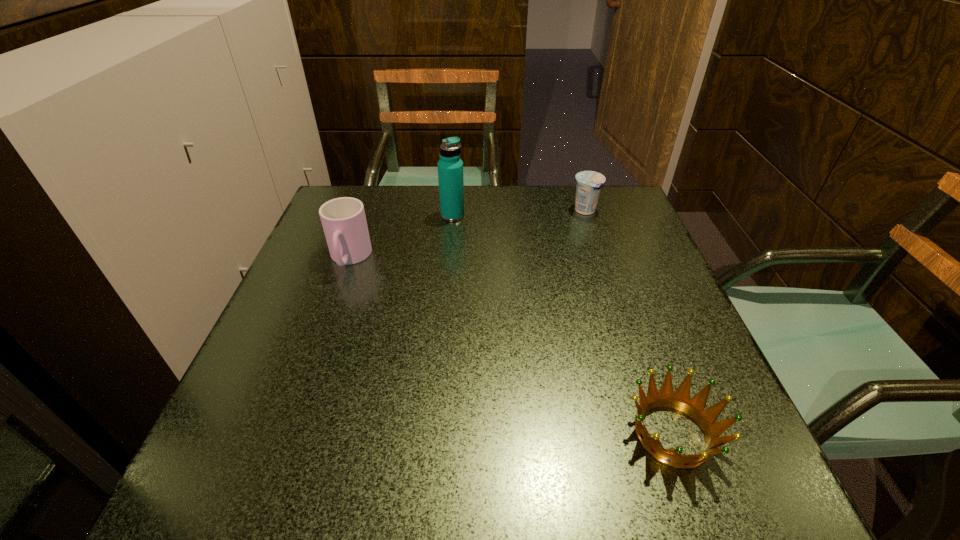
The width and height of the screenshot is (960, 540). What are the coordinates of `free space between the shortest object and the second shortest object` in the screenshot? It's located at (629, 322).

What are the coordinates of `empty space between the third tallest object and the third farthest object` in the screenshot? It's located at (468, 235).

Find the location of `free space between the tallest object and the second shortest object`. free space between the tallest object and the second shortest object is located at coordinates (519, 213).

Where is `vacant area between the nearest object and the yogurt`? The width and height of the screenshot is (960, 540). vacant area between the nearest object and the yogurt is located at coordinates (629, 322).

You are a GUI agent. You are given a task and a screenshot of the screen. Output one action in this format:
    pyautogui.click(x=<x>, y=<y>)
    Task: Click on the unoccupied position between the second shortest object and the third farthest object
    Image resolution: width=960 pixels, height=540 pixels.
    Given the screenshot: What is the action you would take?
    pyautogui.click(x=468, y=235)

Select which object appears as the closest to the second object from left to right. Please provide its 2D coordinates. Your answer should be formatted as a tuple, i.e. [(x, y)], where the tuple contains the x and y coordinates of a point satisfying the conditions above.

[(343, 219)]

Choose which object is the third nearest neighbor to the yogurt. Please provide its 2D coordinates. Your answer should be formatted as a tuple, i.e. [(x, y)], where the tuple contains the x and y coordinates of a point satisfying the conditions above.

[(680, 400)]

Where is `free location that satisfies the following two spatial constraints: 1. with the handle on the side of the shortest object; 2. on the left side of the leftmost object`? This screenshot has height=540, width=960. free location that satisfies the following two spatial constraints: 1. with the handle on the side of the shortest object; 2. on the left side of the leftmost object is located at coordinates (287, 434).

Identify the location of free space that satisfies the following two spatial constraints: 1. on the front side of the crown; 2. on the right side of the third tallest object. (659, 434).